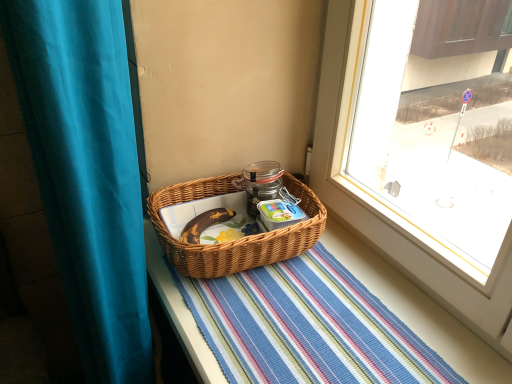
Question: From the image's perspective, relative to woven brown picnic basket at center, is teal fabric curtain at left above or below?

Choices:
 (A) above
 (B) below

Answer: (B)

Question: Is teal fabric curtain at left situated inside woven brown picnic basket at center or outside?

Choices:
 (A) outside
 (B) inside

Answer: (A)

Question: Which of these objects is positioned farthest from the teal fabric curtain at left?

Choices:
 (A) striped woven mat at center
 (B) woven brown picnic basket at center

Answer: (A)

Question: Considering the real-world distances, which object is farthest from the striped woven mat at center?

Choices:
 (A) woven brown picnic basket at center
 (B) teal fabric curtain at left

Answer: (B)